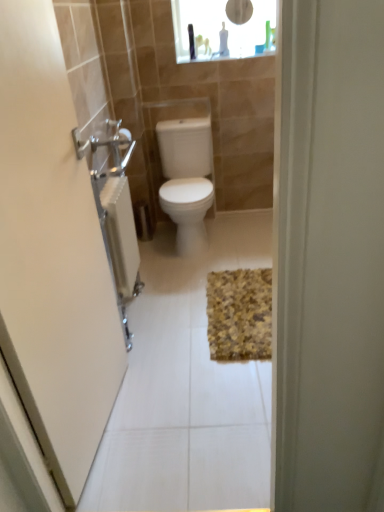
Question: Visually, is transparent glass medicine cabinet at upper center positioned to the left or to the right of yellow textured bath mat at center?

Choices:
 (A) left
 (B) right

Answer: (A)

Question: From the image's perspective, relative to yellow textured bath mat at center, is transparent glass medicine cabinet at upper center above or below?

Choices:
 (A) below
 (B) above

Answer: (B)

Question: Considering the real-world distances, which object is farthest from the white glossy toilet at center?

Choices:
 (A) transparent glass medicine cabinet at upper center
 (B) yellow textured bath mat at center
 (C) brushed metal towel rack at left

Answer: (C)

Question: Which object is the farthest from the white glossy toilet at center?

Choices:
 (A) yellow textured bath mat at center
 (B) brushed metal towel rack at left
 (C) transparent glass medicine cabinet at upper center

Answer: (B)